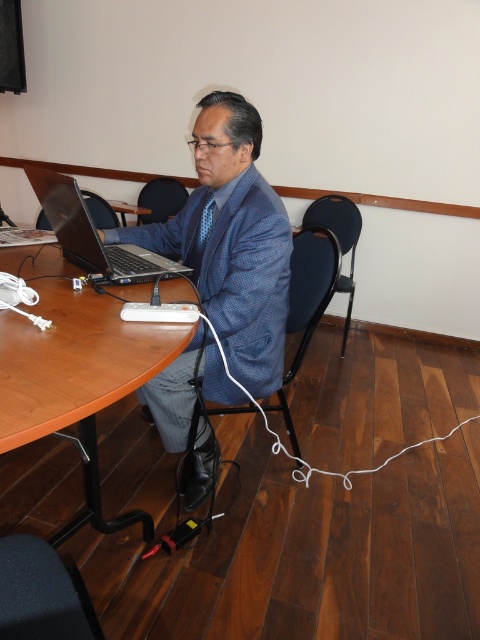
You are standing in front of the table and want to reach both points on the table. Which point is closer to you, point [57,372] or point [71,259]?

Point [57,372] is closer to the viewer than point [71,259].

What is the 2D coordinate of the blue textured suit at center in the image?

The blue textured suit at center is located at the 2D coordinate point of (231, 241).

You are standing at the point with coordinates point [122,275] and want to walk to the point with coordinates point [201,288]. Given that you can only move forward in a straight line, will you be able to reach your destination without moving around any obstacles?

Yes, because point [201,288] is behind point [122,275], so you can move straight back to reach it without needing to go around any obstacles.